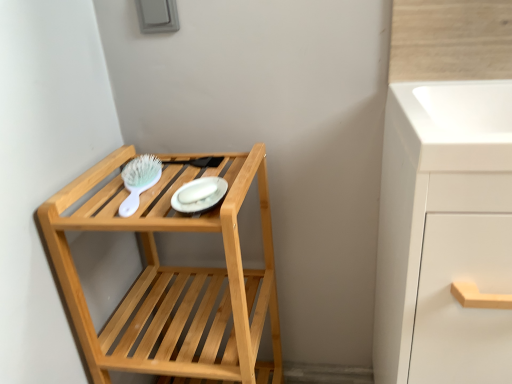
Find the location of a particular element. The image size is (512, 384). vacant space to the right of green plastic brush at upper left is located at coordinates (213, 186).